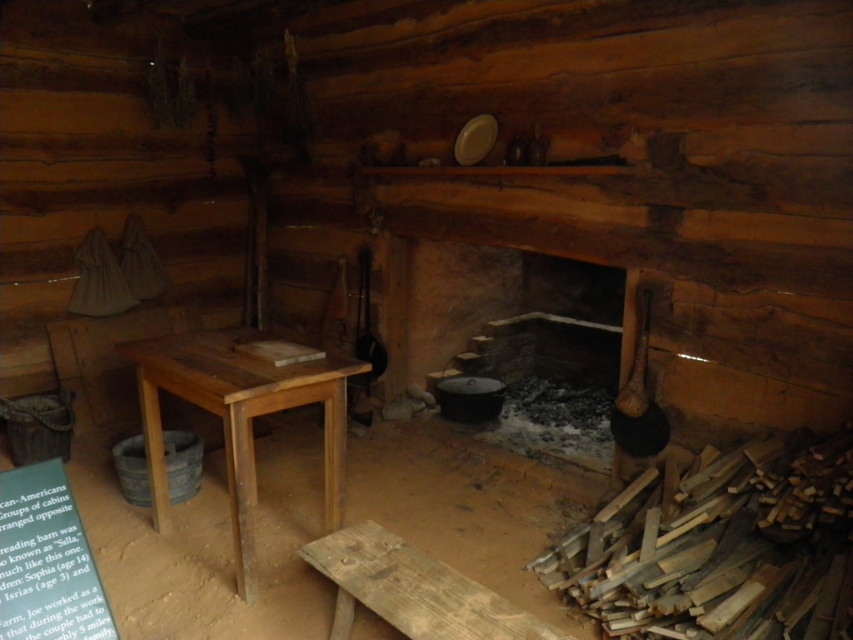
You are moving a small wooden crate that is 0.5 meters wide. You need to place it somewhere in the cabin. Can you put it on the dark brown stone fireplace at center or the weathered wooden bench at lower center?

The dark brown stone fireplace at center is larger in size than the weathered wooden bench at lower center, so it can accommodate the small wooden crate that is 0.5 meters wide. The weathered wooden bench at lower center might be too small.

You are a guest in the log cabin and want to sit down. You see the wooden table at center and the weathered wooden bench at lower center. Which one is closer to you?

The weathered wooden bench at lower center is closer to you because it is behind the wooden table at center, meaning the bench is nearer to your position as you face the scene.

You are a guest in the log cabin and want to place a heavy book on a surface. Which object between the dark brown stone fireplace at center and the wooden table at center would you choose, and why?

You should choose the wooden table at center because the dark brown stone fireplace at center is above it, making the table the more stable and level surface for placing heavy objects.